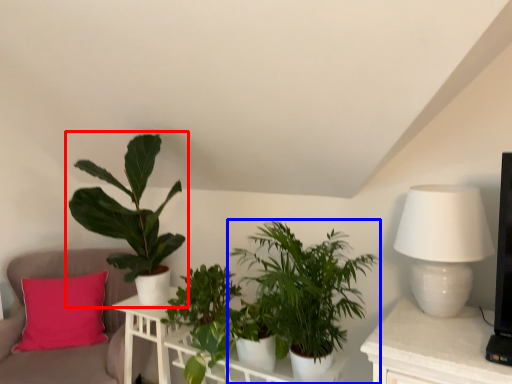
Question: Which point is closer to the camera, houseplant (highlighted by a red box) or houseplant (highlighted by a blue box)?

Choices:
 (A) houseplant
 (B) houseplant

Answer: (B)